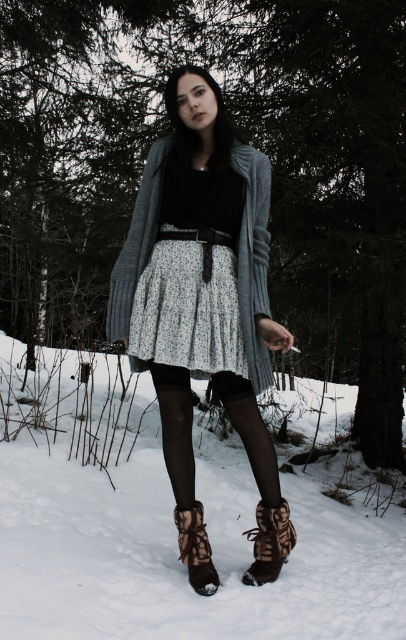
Between point (259, 477) and point (194, 547), which one is positioned behind?

The point (259, 477) is behind.

Between black sheer tights at center and leopard print suede boot at lower center, which one is positioned higher?

black sheer tights at center is above.

Which is behind, point (179, 444) or point (185, 554)?

Point (179, 444)

Identify the location of black sheer tights at center. (175, 428).

Who is more distant from viewer, [79,492] or [155,332]?

Positioned behind is point [79,492].

Is point (293, 557) farther from camera compared to point (151, 321)?

Yes.

At what (x,y) coordinates should I click in order to perform the action: click on white fluffy snow at lower center. Please return your answer as a coordinate pair (x, y). Image resolution: width=406 pixels, height=640 pixels. Looking at the image, I should click on (172, 529).

Does floral-patterned skirt at center have a larger size compared to black sheer tights at center?

Correct, floral-patterned skirt at center is larger in size than black sheer tights at center.

The height and width of the screenshot is (640, 406). What do you see at coordinates (200, 276) in the screenshot?
I see `floral-patterned skirt at center` at bounding box center [200, 276].

Identify the location of floral-patterned skirt at center. (200, 276).